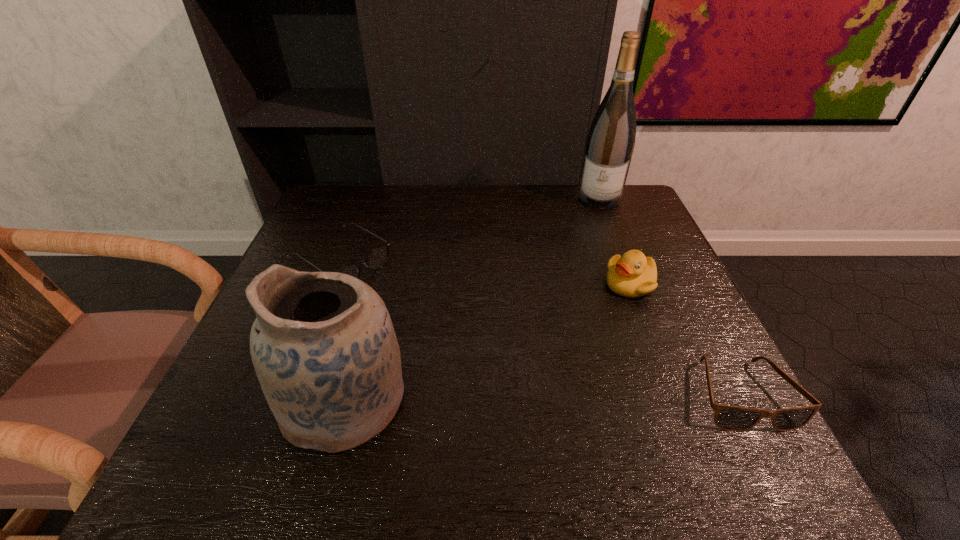
At what (x,y) coordinates should I click in order to perform the action: click on spectacles at the left edge. Please return your answer as a coordinate pair (x, y). This screenshot has width=960, height=540. Looking at the image, I should click on (376, 259).

Locate an element on the screen. sunglasses that is positioned at the right edge is located at coordinates (730, 418).

Find the location of a particular element. The height and width of the screenshot is (540, 960). duckling situated at the right edge is located at coordinates (632, 275).

I want to click on wine bottle that is at the right edge, so click(x=610, y=143).

Where is `object located in the near left corner section of the desktop`? This screenshot has height=540, width=960. object located in the near left corner section of the desktop is located at coordinates 323,346.

At what (x,y) coordinates should I click in order to perform the action: click on object present at the far right corner. Please return your answer as a coordinate pair (x, y). Looking at the image, I should click on (610, 143).

Where is `object that is at the near right corner`? Image resolution: width=960 pixels, height=540 pixels. object that is at the near right corner is located at coordinates (730, 418).

In the image, there is a desktop. Where is `vacant area at the far edge`? The height and width of the screenshot is (540, 960). vacant area at the far edge is located at coordinates (540, 211).

The width and height of the screenshot is (960, 540). I want to click on vacant space at the near edge of the desktop, so click(623, 413).

Locate an element on the screen. The height and width of the screenshot is (540, 960). free space at the right edge is located at coordinates [652, 297].